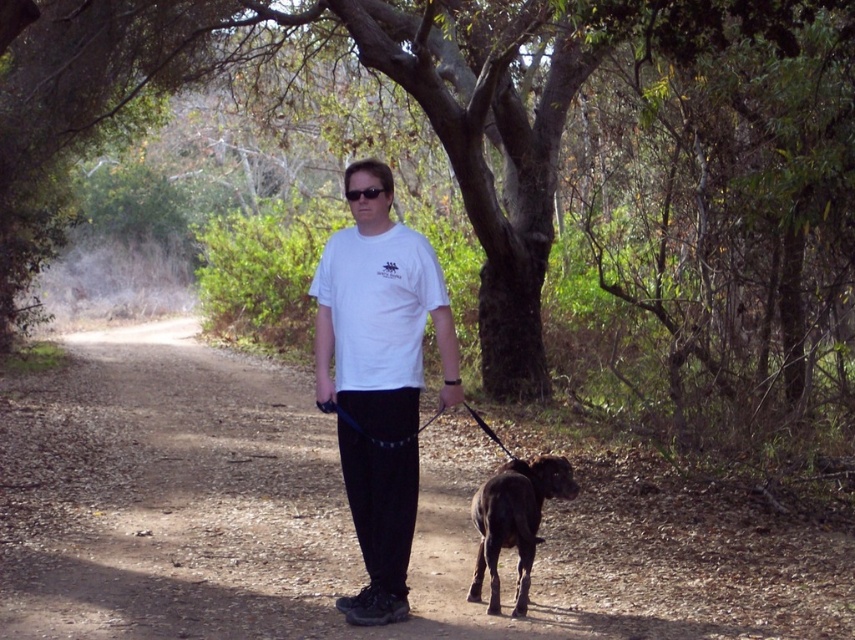
Is green textured tree at center to the right of black glossy dog at center from the viewer's perspective?

In fact, green textured tree at center is to the left of black glossy dog at center.

Measure the distance between point (738, 236) and camera.

The distance of point (738, 236) from camera is 11.49 meters.

Is point (794, 186) positioned in front of point (499, 488)?

That is False.

Where is `green textured tree at center`? green textured tree at center is located at coordinates (516, 138).

Does point (724, 221) come in front of point (396, 332)?

No, it is not.

Consider the image. Does green textured tree at center appear on the right side of white matte t-shirt at center?

In fact, green textured tree at center is to the left of white matte t-shirt at center.

Locate an element on the screen. This screenshot has height=640, width=855. green textured tree at center is located at coordinates (516, 138).

Find the location of a particular element. The image size is (855, 640). green textured tree at center is located at coordinates (516, 138).

Is white matte t-shirt at center positioned before black glossy dog at center?

Yes, it is in front of black glossy dog at center.

Locate an element on the screen. The width and height of the screenshot is (855, 640). white matte t-shirt at center is located at coordinates (379, 314).

Locate an element on the screen. The height and width of the screenshot is (640, 855). white matte t-shirt at center is located at coordinates (379, 314).

At what (x,y) coordinates should I click in order to perform the action: click on white matte t-shirt at center. Please return your answer as a coordinate pair (x, y). Looking at the image, I should click on (379, 314).